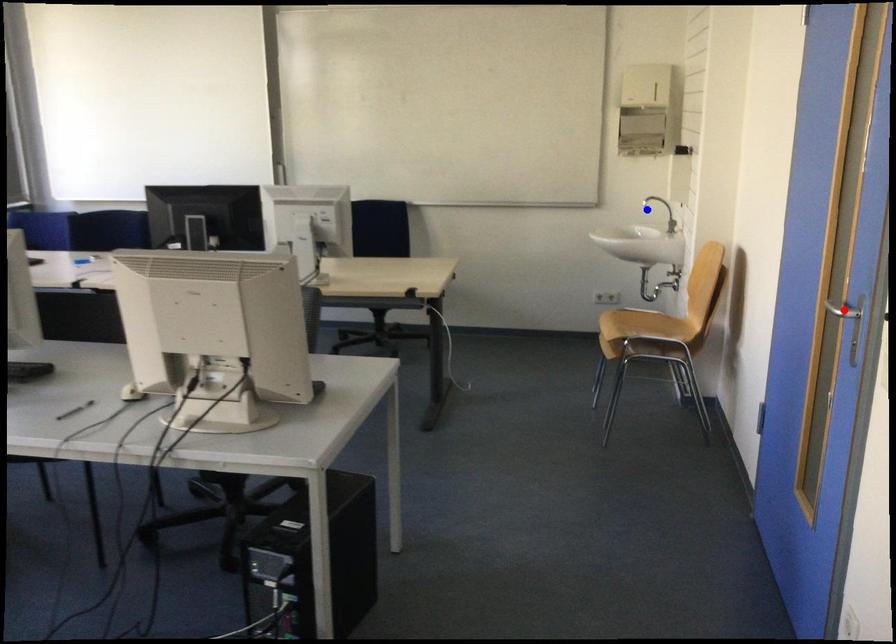
Question: In the image, two points are highlighted. Which point is nearer to the camera? Reply with the corresponding letter.

Choices:
 (A) blue point
 (B) red point

Answer: (B)